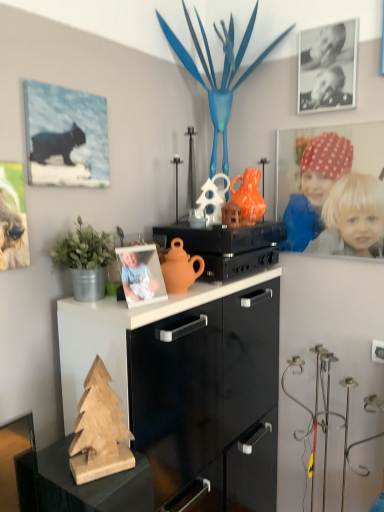
The width and height of the screenshot is (384, 512). Describe the element at coordinates (228, 246) in the screenshot. I see `matte black stereo at center` at that location.

Locate an element on the screen. green matte plant at left is located at coordinates (85, 260).

Describe the element at coordinates (85, 260) in the screenshot. I see `green matte plant at left` at that location.

Find the location of a particular element. polka dot fabric headscarf at upper right is located at coordinates (315, 188).

The image size is (384, 512). Identify the location of matte black stereo at center. [x=228, y=246].

Which object is wider, wooden christmas tree at lower left or matte orange teapot at center?

matte orange teapot at center is wider.

In the scene shown: Does wooden christmas tree at lower left appear on the left side of matte orange teapot at center?

Indeed, wooden christmas tree at lower left is positioned on the left side of matte orange teapot at center.

From the image's perspective, between wooden christmas tree at lower left and matte orange teapot at center, which one is located above?

matte orange teapot at center.

Is green matte plant at left to the left of wooden christmas tree at lower left from the viewer's perspective?

Yes.

Consider the image. Is green matte plant at left shorter than wooden christmas tree at lower left?

Yes, green matte plant at left is shorter than wooden christmas tree at lower left.

Considering the sizes of objects green matte plant at left and wooden christmas tree at lower left in the image provided, who is bigger, green matte plant at left or wooden christmas tree at lower left?

green matte plant at left.

Considering the relative sizes of green matte plant at left and wooden christmas tree at lower left in the image provided, is green matte plant at left wider than wooden christmas tree at lower left?

Yes, green matte plant at left is wider than wooden christmas tree at lower left.

From a real-world perspective, between black matte photo frame at upper right, which is counted as the 2th picture frame, starting from the left, and polka dot fabric headscarf at upper right, who is vertically lower?

In real-world perspective, polka dot fabric headscarf at upper right is lower.

Can you see black matte photo frame at upper right, which is the 1th picture frame in top-to-bottom order, touching polka dot fabric headscarf at upper right?

black matte photo frame at upper right, which is the 1th picture frame in top-to-bottom order, and polka dot fabric headscarf at upper right are not in contact.

From the image's perspective, who appears lower, black matte photo frame at upper right, the 1th picture frame viewed from the back, or polka dot fabric headscarf at upper right?

polka dot fabric headscarf at upper right.

Which object is thinner, black matte photo frame at upper right, which is counted as the 2th picture frame, starting from the left, or polka dot fabric headscarf at upper right?

With smaller width is black matte photo frame at upper right, which is counted as the 2th picture frame, starting from the left.

Can you confirm if wooden christmas tree at lower left is smaller than black matte photo frame at upper right, the 1th picture frame viewed from the back?

No.

From the image's perspective, is wooden christmas tree at lower left located above or below black matte photo frame at upper right, which is counted as the 2th picture frame, starting from the left?

From the image's perspective, wooden christmas tree at lower left appears below black matte photo frame at upper right, which is counted as the 2th picture frame, starting from the left.

Does wooden christmas tree at lower left touch black matte photo frame at upper right, which is the 1th picture frame in top-to-bottom order?

No, wooden christmas tree at lower left is not in contact with black matte photo frame at upper right, which is the 1th picture frame in top-to-bottom order.

Who is shorter, wooden christmas tree at lower left or black matte photo frame at upper right, which appears as the second picture frame when viewed from the front?

wooden christmas tree at lower left.

From the image's perspective, would you say green matte plant at left is positioned over matte orange teapot at center?

Correct, green matte plant at left appears higher than matte orange teapot at center in the image.

Which of these two, green matte plant at left or matte orange teapot at center, stands taller?

green matte plant at left is taller.

Can we say green matte plant at left lies outside matte orange teapot at center?

green matte plant at left lies outside matte orange teapot at center's area.

Image resolution: width=384 pixels, height=512 pixels. I want to click on houseplant above the matte orange teapot at center (from a real-world perspective), so click(85, 260).

Are matte canvas print of cat at upper left, marked as the second picture frame in a back-to-front arrangement, and green matte plant at left beside each other?

No, matte canvas print of cat at upper left, marked as the second picture frame in a back-to-front arrangement, is not next to green matte plant at left.

Does matte canvas print of cat at upper left, placed as the 2th picture frame when sorted from right to left, turn towards green matte plant at left?

No, matte canvas print of cat at upper left, placed as the 2th picture frame when sorted from right to left, is not aimed at green matte plant at left.

In terms of width, does matte canvas print of cat at upper left, the second picture frame in the top-to-bottom sequence, look wider or thinner when compared to green matte plant at left?

Clearly, matte canvas print of cat at upper left, the second picture frame in the top-to-bottom sequence, has less width compared to green matte plant at left.

Is matte canvas print of cat at upper left, placed as the 2th picture frame when sorted from right to left, situated inside polka dot fabric headscarf at upper right or outside?

The correct answer is: outside.

Considering the positions of objects matte canvas print of cat at upper left, which is the first picture frame in front-to-back order, and polka dot fabric headscarf at upper right in the image provided, who is in front, matte canvas print of cat at upper left, which is the first picture frame in front-to-back order, or polka dot fabric headscarf at upper right?

matte canvas print of cat at upper left, which is the first picture frame in front-to-back order, is in front.

From a real-world perspective, does matte canvas print of cat at upper left, marked as the 1th picture frame in a bottom-to-top arrangement, stand above polka dot fabric headscarf at upper right?

Indeed, from a real-world perspective, matte canvas print of cat at upper left, marked as the 1th picture frame in a bottom-to-top arrangement, stands above polka dot fabric headscarf at upper right.

Find the location of a particular element. christmas tree that is under the matte orange teapot at center (from a real-world perspective) is located at coordinates (99, 430).

Identify the location of christmas tree located in front of the green matte plant at left. Image resolution: width=384 pixels, height=512 pixels. (99, 430).

Based on their spatial positions, is green matte plant at left or wooden christmas tree at lower left further from matte orange teapot at center?

The object further to matte orange teapot at center is wooden christmas tree at lower left.

Which object lies further to the anchor point green matte plant at left, polka dot fabric headscarf at upper right or wooden christmas tree at lower left?

polka dot fabric headscarf at upper right is positioned further to the anchor green matte plant at left.

Estimate the real-world distances between objects in this image. Which object is further from matte black stereo at center, polka dot fabric headscarf at upper right or green matte plant at left?

Based on the image, green matte plant at left appears to be further to matte black stereo at center.

Looking at the image, which one is located further to polka dot fabric headscarf at upper right, wooden christmas tree at lower left or matte canvas print of cat at upper left, marked as the 1th picture frame in a bottom-to-top arrangement?

wooden christmas tree at lower left is positioned further to the anchor polka dot fabric headscarf at upper right.

Which object lies further to the anchor point wooden christmas tree at lower left, green matte plant at left or matte canvas print of cat at upper left, marked as the 1th picture frame in a bottom-to-top arrangement?

Based on the image, matte canvas print of cat at upper left, marked as the 1th picture frame in a bottom-to-top arrangement, appears to be further to wooden christmas tree at lower left.

Which object lies nearer to the anchor point black matte photo frame at upper right, which is the 1th picture frame in top-to-bottom order, matte black stereo at center or matte orange teapot at center?

matte black stereo at center is closer to black matte photo frame at upper right, which is the 1th picture frame in top-to-bottom order.

Considering their positions, is matte black stereo at center positioned closer to green matte plant at left than wooden christmas tree at lower left?

wooden christmas tree at lower left lies closer to green matte plant at left than the other object.

Looking at the image, which one is located further to matte canvas print of cat at upper left, marked as the second picture frame in a back-to-front arrangement, green matte plant at left or black matte photo frame at upper right, the 1th picture frame when ordered from right to left?

The object further to matte canvas print of cat at upper left, marked as the second picture frame in a back-to-front arrangement, is black matte photo frame at upper right, the 1th picture frame when ordered from right to left.

Find the location of a particular element. The width and height of the screenshot is (384, 512). toy between matte canvas print of cat at upper left, placed as the 2th picture frame when sorted from right to left, and matte black stereo at center from left to right is located at coordinates (180, 268).

This screenshot has width=384, height=512. I want to click on houseplant between matte canvas print of cat at upper left, placed as the 2th picture frame when sorted from right to left, and matte black stereo at center, so click(85, 260).

Find the location of a particular element. Image resolution: width=384 pixels, height=512 pixels. appliance located between matte canvas print of cat at upper left, the second picture frame in the top-to-bottom sequence, and black matte photo frame at upper right, the 1th picture frame viewed from the back, in the left-right direction is located at coordinates (228, 246).

What are the coordinates of `houseplant between matte canvas print of cat at upper left, which is the first picture frame in front-to-back order, and wooden christmas tree at lower left in the up-down direction` in the screenshot? It's located at (85, 260).